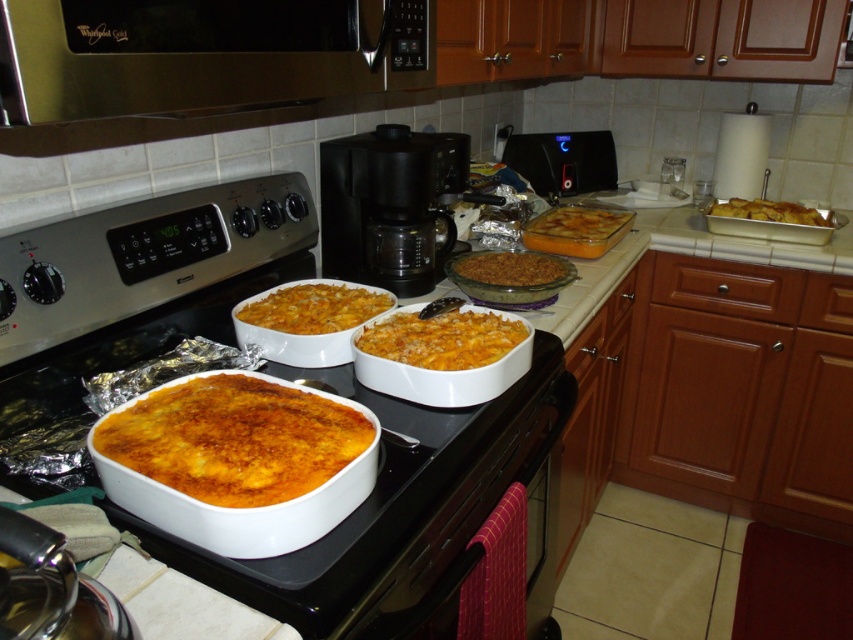
Is golden brown baked dish at center in front of black plastic toaster oven at upper center?

Yes, golden brown baked dish at center is in front of black plastic toaster oven at upper center.

Who is higher up, golden brown baked dish at center or black plastic toaster oven at upper center?

Positioned higher is black plastic toaster oven at upper center.

Between point (282, 419) and point (585, 163), which one is positioned behind?

Point (585, 163)

Locate an element on the screen. Image resolution: width=853 pixels, height=640 pixels. golden brown baked dish at center is located at coordinates tap(234, 438).

Between brushed metal microwave at upper center and black plastic coffee maker at center, which one is positioned lower?

Positioned lower is black plastic coffee maker at center.

Does brushed metal microwave at upper center have a greater width compared to black plastic coffee maker at center?

Correct, the width of brushed metal microwave at upper center exceeds that of black plastic coffee maker at center.

Is point (196, 10) positioned behind point (428, 232)?

No, (196, 10) is in front of (428, 232).

Locate an element on the screen. brushed metal microwave at upper center is located at coordinates (202, 54).

Is black plastic toaster oven at upper center smaller than golden brown crusty casserole at center?

Incorrect, black plastic toaster oven at upper center is not smaller in size than golden brown crusty casserole at center.

Who is positioned more to the right, black plastic toaster oven at upper center or golden brown crusty casserole at center?

Positioned to the right is black plastic toaster oven at upper center.

Find the location of a particular element. The width and height of the screenshot is (853, 640). black plastic toaster oven at upper center is located at coordinates (563, 161).